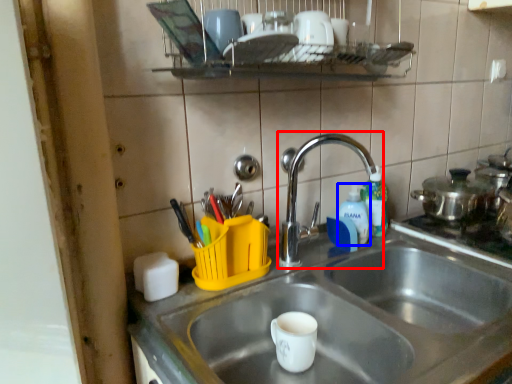
Question: Which point is closer to the camera, tap (highlighted by a red box) or bottle (highlighted by a blue box)?

Choices:
 (A) tap
 (B) bottle

Answer: (A)